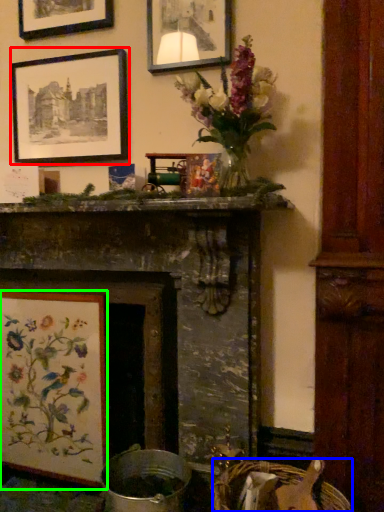
Question: Considering the real-world distances, which object is farthest from picture frame (highlighted by a red box)? basket (highlighted by a blue box) or picture frame (highlighted by a green box)?

Choices:
 (A) basket
 (B) picture frame

Answer: (A)